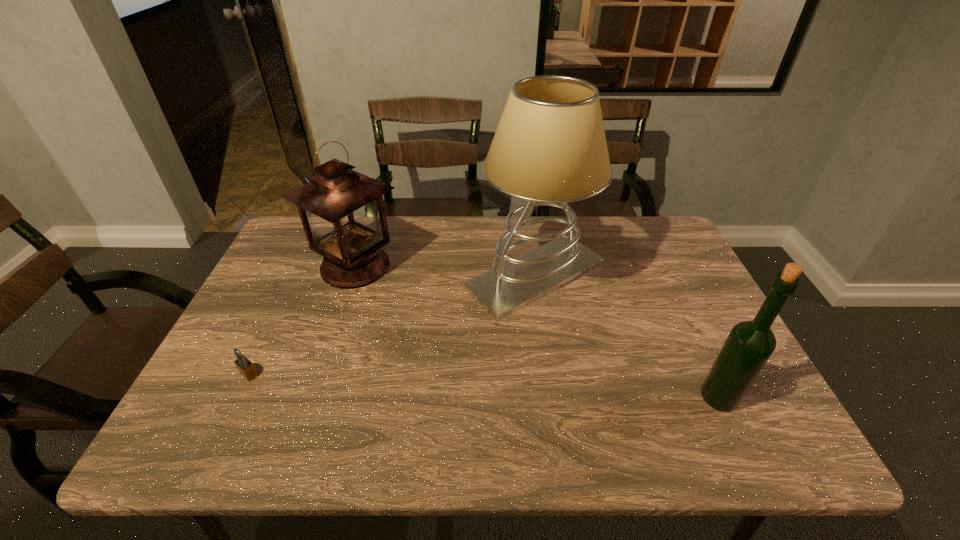
Find the location of `free space that is in between the nearest object and the tallest object`. free space that is in between the nearest object and the tallest object is located at coordinates point(627,336).

The width and height of the screenshot is (960, 540). Find the location of `free space between the third farthest object and the rightmost object`. free space between the third farthest object and the rightmost object is located at coordinates pyautogui.click(x=484, y=386).

Identify which object is the nearest to the padlock. Please provide its 2D coordinates. Your answer should be formatted as a tuple, i.e. [(x, y)], where the tuple contains the x and y coordinates of a point satisfying the conditions above.

[(342, 211)]

The width and height of the screenshot is (960, 540). What are the coordinates of `object that stands as the closest to the oil lamp` in the screenshot? It's located at (549, 148).

Identify the location of vacant space that satisfies the following two spatial constraints: 1. on the back side of the third object from left to right; 2. on the left side of the padlock. The image size is (960, 540). (297, 275).

Locate an element on the screen. The image size is (960, 540). free space in the image that satisfies the following two spatial constraints: 1. on the back side of the third object from left to right; 2. on the right side of the shortest object is located at coordinates (297, 275).

In order to click on free space that satisfies the following two spatial constraints: 1. on the front side of the oil lamp; 2. on the left side of the liquor in this screenshot , I will do `click(311, 398)`.

Image resolution: width=960 pixels, height=540 pixels. Find the location of `free space that satisfies the following two spatial constraints: 1. on the front side of the oil lamp; 2. on the left side of the third object from left to right`. free space that satisfies the following two spatial constraints: 1. on the front side of the oil lamp; 2. on the left side of the third object from left to right is located at coordinates (352, 275).